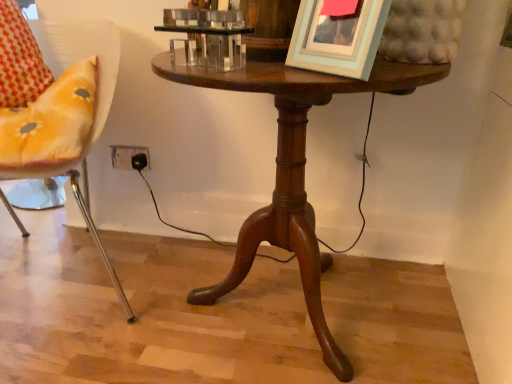
Question: Considering the relative sizes of mahogany wood table at center and light blue matte picture frame at upper right in the image provided, is mahogany wood table at center wider than light blue matte picture frame at upper right?

Choices:
 (A) yes
 (B) no

Answer: (A)

Question: Is mahogany wood table at center far away from light blue matte picture frame at upper right?

Choices:
 (A) yes
 (B) no

Answer: (B)

Question: Is light blue matte picture frame at upper right at the back of mahogany wood table at center?

Choices:
 (A) yes
 (B) no

Answer: (B)

Question: Is mahogany wood table at center in front of light blue matte picture frame at upper right?

Choices:
 (A) no
 (B) yes

Answer: (A)

Question: Does mahogany wood table at center come behind light blue matte picture frame at upper right?

Choices:
 (A) no
 (B) yes

Answer: (B)

Question: From a real-world perspective, is light blue matte picture frame at upper right positioned above or below mahogany wood table at center?

Choices:
 (A) below
 (B) above

Answer: (B)

Question: Looking at their shapes, would you say light blue matte picture frame at upper right is wider or thinner than mahogany wood table at center?

Choices:
 (A) thin
 (B) wide

Answer: (A)

Question: In terms of height, does light blue matte picture frame at upper right look taller or shorter compared to mahogany wood table at center?

Choices:
 (A) short
 (B) tall

Answer: (A)

Question: Considering the positions of point (333, 18) and point (411, 77), is point (333, 18) closer or farther from the camera than point (411, 77)?

Choices:
 (A) farther
 (B) closer

Answer: (B)

Question: From the image's perspective, is mahogany wood table at center above or below metallic yellow chair at left?

Choices:
 (A) above
 (B) below

Answer: (B)

Question: In the image, is mahogany wood table at center positioned in front of or behind metallic yellow chair at left?

Choices:
 (A) front
 (B) behind

Answer: (A)

Question: Based on their sizes in the image, would you say mahogany wood table at center is bigger or smaller than metallic yellow chair at left?

Choices:
 (A) small
 (B) big

Answer: (A)

Question: Is mahogany wood table at center wider or thinner than metallic yellow chair at left?

Choices:
 (A) wide
 (B) thin

Answer: (B)

Question: Do you think mahogany wood table at center is within light blue matte picture frame at upper right, or outside of it?

Choices:
 (A) inside
 (B) outside

Answer: (B)

Question: From the image's perspective, is mahogany wood table at center above or below light blue matte picture frame at upper right?

Choices:
 (A) above
 (B) below

Answer: (B)